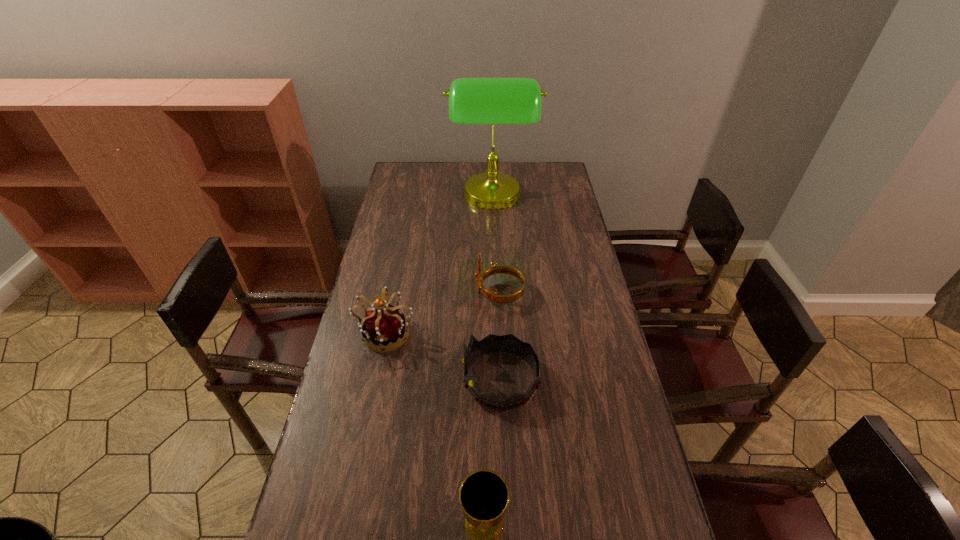
At what (x,y) coordinates should I click in order to perform the action: click on free region located on the front-facing side of the leftmost object. Please return your answer as a coordinate pair (x, y). The height and width of the screenshot is (540, 960). Looking at the image, I should click on (363, 446).

This screenshot has width=960, height=540. I want to click on object that is at the far edge, so click(492, 101).

This screenshot has width=960, height=540. Find the location of `object situated at the left edge`. object situated at the left edge is located at coordinates (384, 326).

Identify the location of free space at the far edge of the desktop. This screenshot has width=960, height=540. (438, 180).

In the image, there is a desktop. Where is `vacant space at the left edge`? vacant space at the left edge is located at coordinates (393, 224).

This screenshot has height=540, width=960. In order to click on blank space at the right edge in this screenshot , I will do `click(560, 283)`.

You are a GUI agent. You are given a task and a screenshot of the screen. Output one action in this format:
    pyautogui.click(x=<x>, y=<y>)
    Task: Click on the free spot at the far left corner of the desktop
    
    Given the screenshot: What is the action you would take?
    pyautogui.click(x=421, y=171)

At what (x,y) coordinates should I click in order to perform the action: click on free spot between the leftmost tiara and the farthest tiara. Please return your answer as a coordinate pair (x, y). Image resolution: width=960 pixels, height=540 pixels. Looking at the image, I should click on (443, 313).

Find the location of a particular element. free space between the tallest object and the farthest tiara is located at coordinates (496, 246).

You are a GUI agent. You are given a task and a screenshot of the screen. Output one action in this format:
    pyautogui.click(x=<x>, y=<y>)
    Task: Click on the vacant space that is in between the second farthest object and the tallest object
    
    Given the screenshot: What is the action you would take?
    pyautogui.click(x=496, y=246)